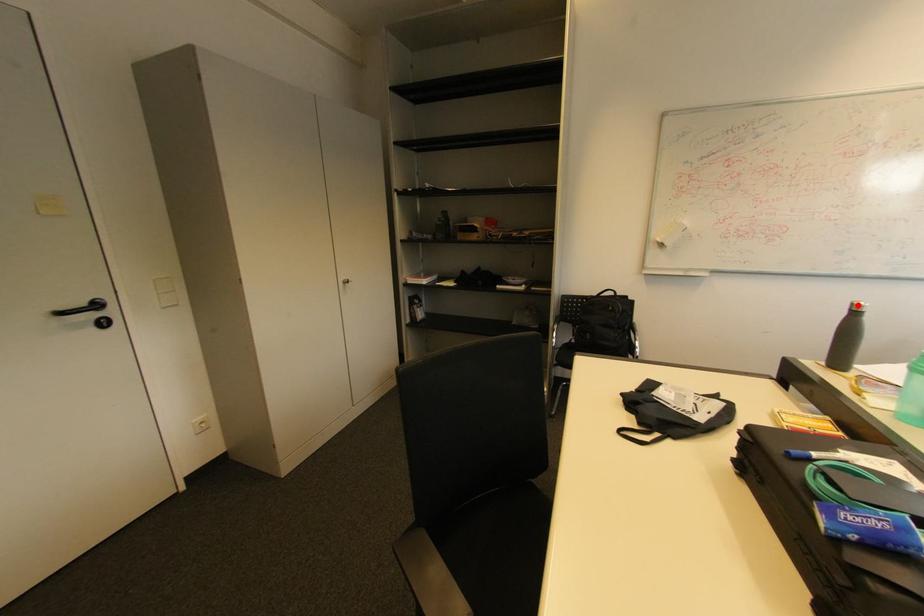
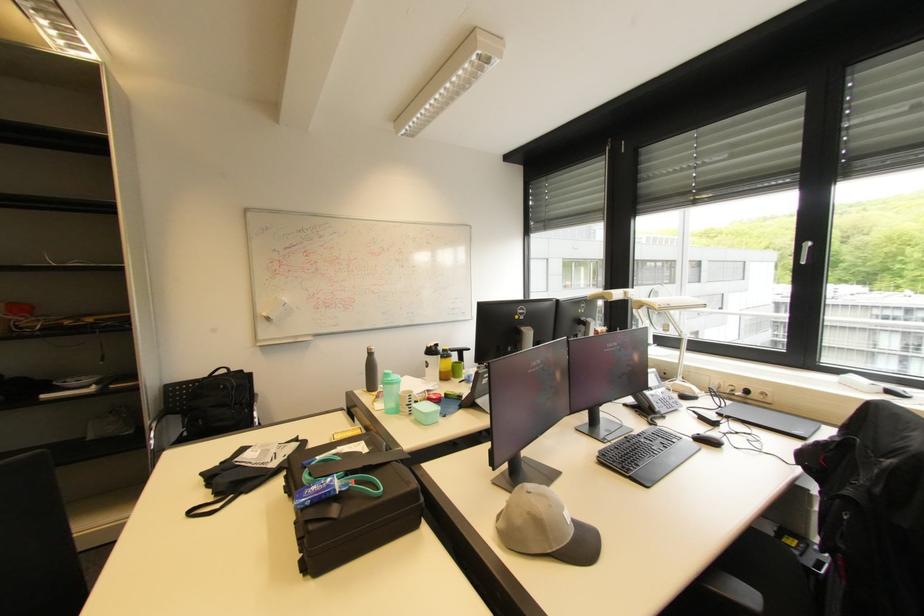
Where in the second image is the point corresponding to the highlighted location from the first image?

(372, 350)